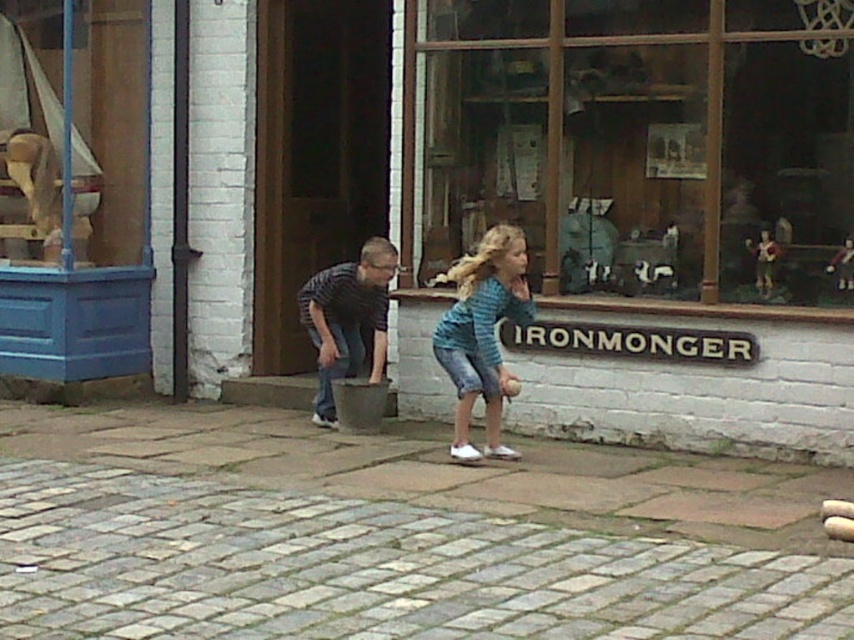
Is point (726, 125) positioned before point (478, 250)?

That is False.

Between wooden display case at center and blue striped shirt at center, which one has more height?

With more height is wooden display case at center.

Describe the element at coordinates (644, 141) in the screenshot. I see `wooden display case at center` at that location.

Find the location of a particular element. The width and height of the screenshot is (854, 640). wooden display case at center is located at coordinates (644, 141).

Measure the distance between point [466,300] and camera.

Point [466,300] and camera are 8.42 meters apart.

Between point (480, 362) and point (361, 349), which one is positioned in front?

Point (480, 362) is in front.

Find the location of a particular element. This screenshot has height=640, width=854. blue striped shirt at center is located at coordinates (483, 332).

From the picture: Between wooden display case at center and brushed metal bucket at center, which one is positioned lower?

Positioned lower is brushed metal bucket at center.

Does wooden display case at center have a lesser width compared to brushed metal bucket at center?

Answer: In fact, wooden display case at center might be wider than brushed metal bucket at center.

Which is in front, point (486, 163) or point (309, 332)?

Point (309, 332)

Find the location of `wooden display case at center`. wooden display case at center is located at coordinates (644, 141).